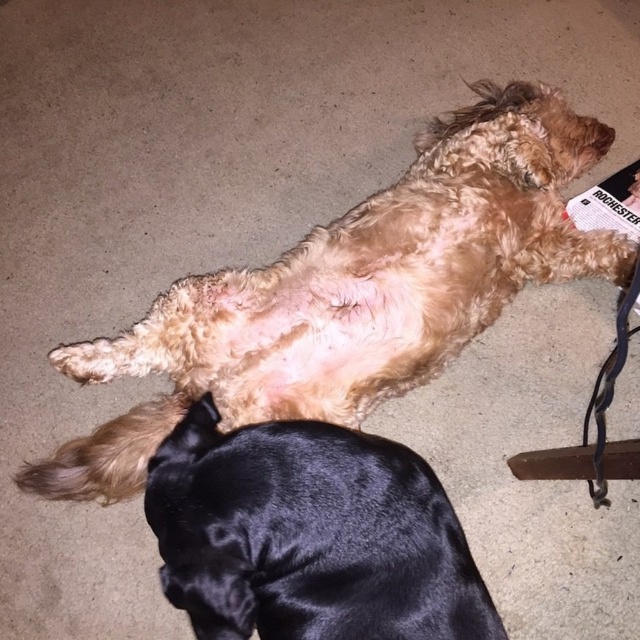
Is fuzzy brown dog at center shorter than black silky dog at lower center?

No, fuzzy brown dog at center is not shorter than black silky dog at lower center.

Is fuzzy brown dog at center behind black silky dog at lower center?

Yes, it is behind black silky dog at lower center.

The image size is (640, 640). Find the location of `fuzzy brown dog at center`. fuzzy brown dog at center is located at coordinates (355, 291).